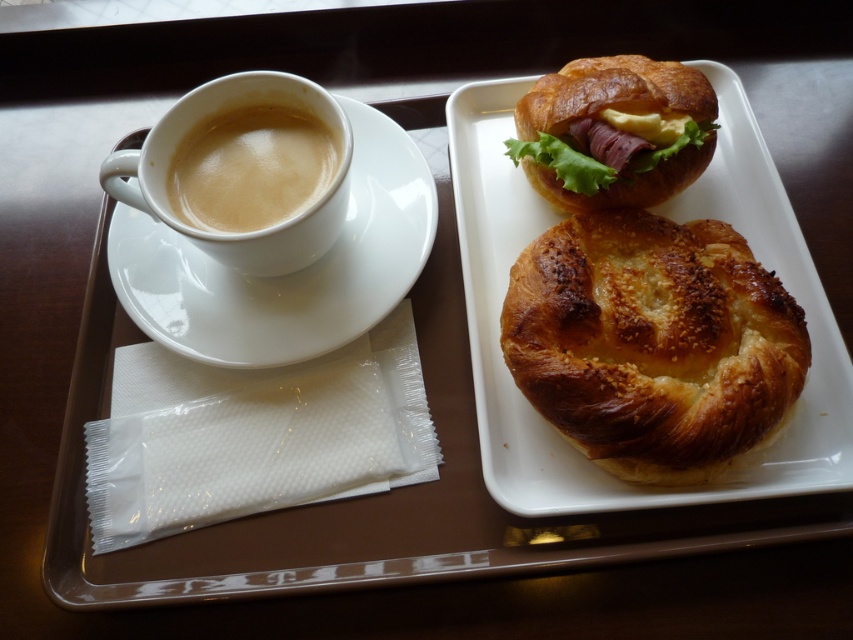
Can you confirm if golden brown flaky pastry at center is positioned to the left of white glossy saucer at upper left?

No, golden brown flaky pastry at center is not to the left of white glossy saucer at upper left.

Does point (753, 262) lie behind point (328, 346)?

No.

Locate an element on the screen. golden brown flaky pastry at center is located at coordinates (653, 342).

Which is above, white glossy saucer at upper left or golden brown croissant at upper center?

golden brown croissant at upper center is higher up.

Which is behind, point (170, 336) or point (677, 179)?

Point (677, 179)

Is point (376, 131) closer to camera compared to point (550, 108)?

No, it is not.

Image resolution: width=853 pixels, height=640 pixels. Find the location of `white glossy saucer at upper left`. white glossy saucer at upper left is located at coordinates (288, 273).

Is golden brown bread at upper center positioned in front of white glossy saucer at upper left?

Yes, golden brown bread at upper center is in front of white glossy saucer at upper left.

I want to click on golden brown bread at upper center, so click(672, 218).